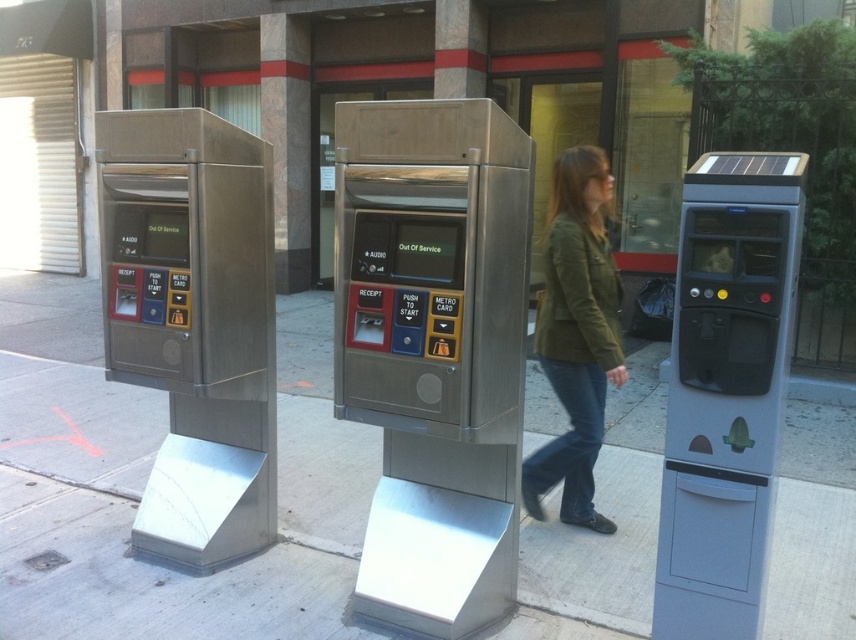
Question: Among these objects, which one is farthest from the camera?

Choices:
 (A) gray plastic parking meter at right
 (B) metallic atm at center
 (C) brushed metal pavement at center
 (D) olive green jacket at center

Answer: (C)

Question: Does metallic atm at center appear under brushed metal pavement at center?

Choices:
 (A) no
 (B) yes

Answer: (A)

Question: Does metallic atm at center have a larger size compared to stainless steel atm at left?

Choices:
 (A) yes
 (B) no

Answer: (B)

Question: Can you confirm if metallic atm at center is smaller than stainless steel atm at left?

Choices:
 (A) yes
 (B) no

Answer: (A)

Question: Among these points, which one is nearest to the camera?

Choices:
 (A) (134, 444)
 (B) (581, 468)

Answer: (B)

Question: Among these points, which one is nearest to the camera?

Choices:
 (A) (238, 524)
 (B) (733, 561)
 (C) (468, 275)
 (D) (583, 412)

Answer: (B)